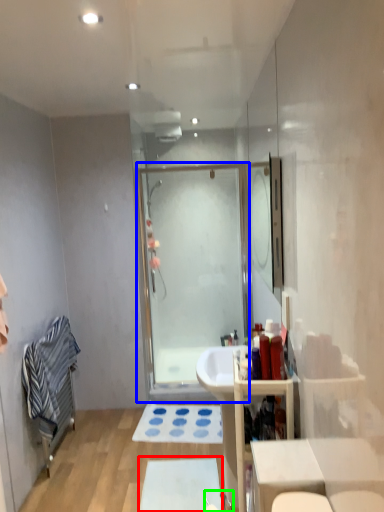
Question: Considering the real-world distances, which object is farthest from bath mat (highlighted by a red box)? screen door (highlighted by a blue box) or faucet (highlighted by a green box)?

Choices:
 (A) screen door
 (B) faucet

Answer: (A)